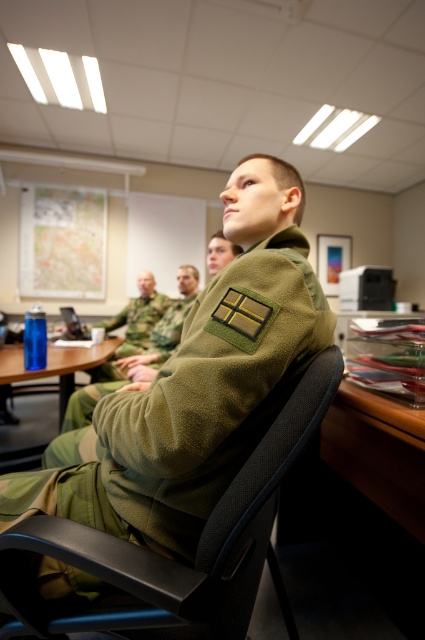
Looking at this image, you are standing in the meeting room and need to identify the exact location of the camouflage fabric uniform at center. Based on the coordinate system where the bottom left corner is the origin, can you determine if it is closer to the center of the room or the right wall?

The camouflage fabric uniform at center is located at point (149, 342). Since the coordinates are normalized between 0 and 1, the center of the room would be at approximately (212, 320). The uniform is slightly to the right and slightly below the center point, so it is closer to the center of the room than the right wall.

You are a photographer positioned at the point with coordinates (149, 342) in the image. You need to capture a closeup shot of the map on the wall behind the camouflage fabric uniform at center. Is your current position suitable for taking the photo without any obstructions?

The point at (149, 342) corresponds to the camouflage fabric uniform at center, so you are positioned directly at the camouflage fabric uniform at center. To capture the map on the wall behind, you would need to move behind or around the camouflage fabric uniform at center to avoid obstruction.